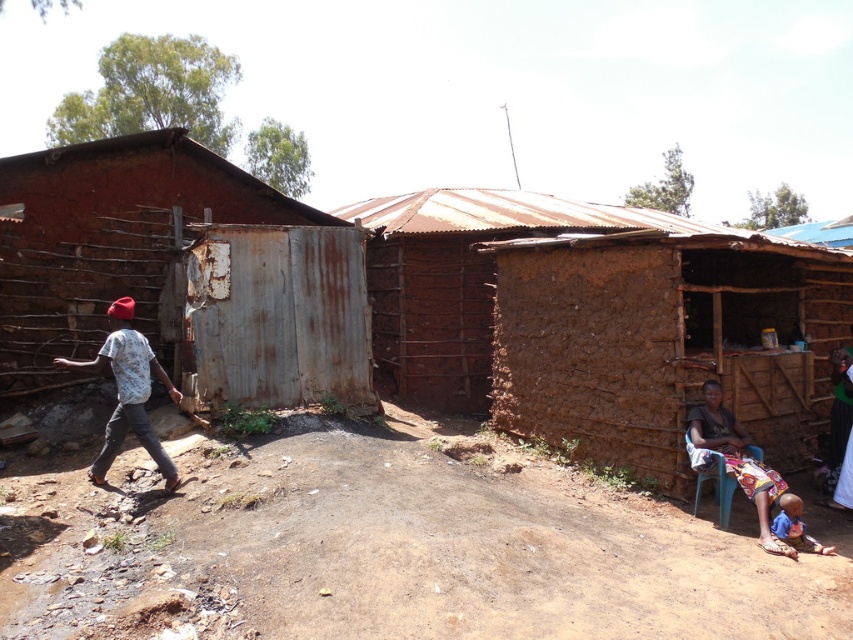
Question: Which point appears closest to the camera in this image?

Choices:
 (A) (788, 544)
 (B) (764, 508)
 (C) (844, 368)
 (D) (399, 365)

Answer: (A)

Question: Among these objects, which one is nearest to the camera?

Choices:
 (A) blue cotton shirt at lower right
 (B) green fabric dress at lower right
 (C) printed fabric skirt at lower right

Answer: (A)

Question: Which point is farther to the camera?

Choices:
 (A) brown dirt field at center
 (B) white printed shirt at left
 (C) printed fabric skirt at lower right
 (D) brown mud hut at center

Answer: (D)

Question: Can you confirm if printed fabric skirt at lower right is positioned below green fabric dress at lower right?

Choices:
 (A) no
 (B) yes

Answer: (A)

Question: Does rusty metal hut at left have a smaller size compared to brown mud hut at center?

Choices:
 (A) no
 (B) yes

Answer: (B)

Question: Does white printed shirt at left have a larger size compared to printed fabric skirt at lower right?

Choices:
 (A) no
 (B) yes

Answer: (B)